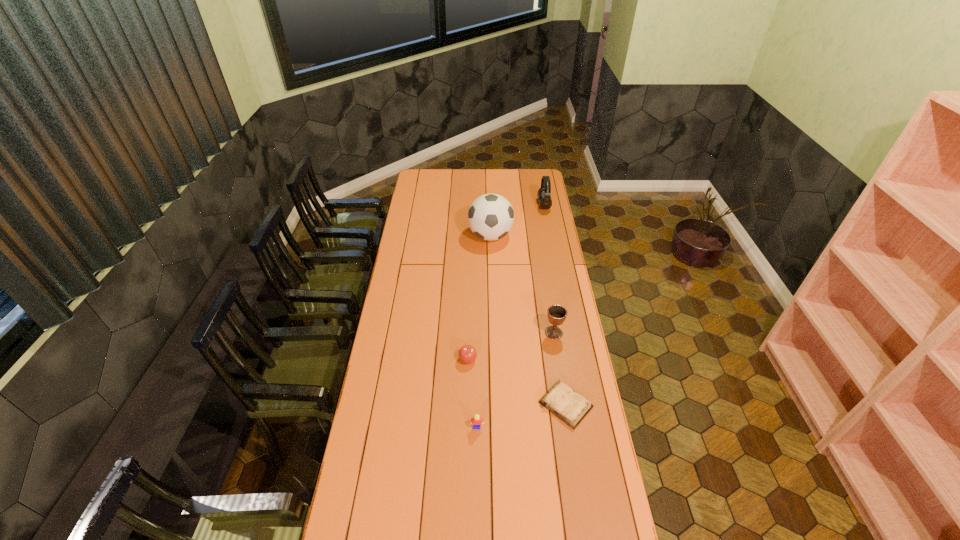
Identify the location of free spot located 0.140m on the earcups of the fifth shortest object. Image resolution: width=960 pixels, height=540 pixels. (515, 206).

The image size is (960, 540). Identify the location of vacant region located 0.090m on the earcups of the fifth shortest object. (522, 206).

I want to click on vacant area located on the earcups of the fifth shortest object, so click(477, 206).

Identify the location of free space located on the left of the fourth nearest object. (480, 333).

Locate an element on the screen. free location located 0.130m on the front of the third nearest object is located at coordinates (467, 395).

Where is `vacant space located 0.070m on the front-facing side of the Lego`? Image resolution: width=960 pixels, height=540 pixels. vacant space located 0.070m on the front-facing side of the Lego is located at coordinates (477, 449).

Where is `free space located 0.090m on the back of the diary`? The height and width of the screenshot is (540, 960). free space located 0.090m on the back of the diary is located at coordinates (559, 363).

Find the location of a particular element. headset that is at the right edge is located at coordinates (544, 193).

At what (x,y) coordinates should I click in order to perform the action: click on chalice that is at the right edge. Please return your answer as a coordinate pair (x, y). The image size is (960, 540). Looking at the image, I should click on (556, 314).

Locate an element on the screen. diary located at the right edge is located at coordinates (571, 407).